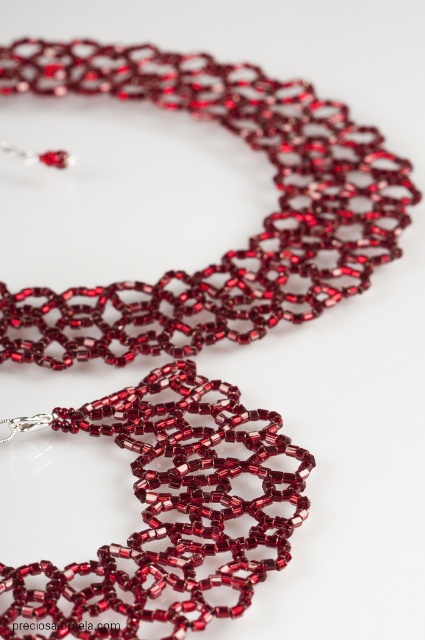
Question: In this image, where is matte glass necklace at upper center located relative to matte glass beaded necklace at center?

Choices:
 (A) right
 (B) left

Answer: (B)

Question: In this image, where is matte glass necklace at upper center located relative to matte glass beaded necklace at center?

Choices:
 (A) above
 (B) below

Answer: (A)

Question: Which point appears farthest from the camera in this image?

Choices:
 (A) (285, 260)
 (B) (122, 577)

Answer: (A)

Question: Does matte glass necklace at upper center have a larger size compared to matte glass beaded necklace at center?

Choices:
 (A) no
 (B) yes

Answer: (B)